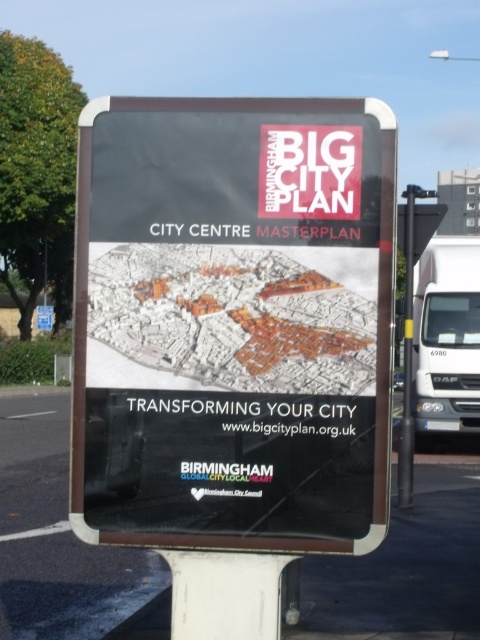
Question: Which object is farther from the camera taking this photo?

Choices:
 (A) matte black sign at center
 (B) blue plastic street sign at upper left
 (C) white plastic pole at right

Answer: (B)

Question: Which object appears farthest from the camera in this image?

Choices:
 (A) white plastic pole at right
 (B) metallic pole at right

Answer: (B)

Question: Is metallic pole at right behind blue plastic street sign at upper left?

Choices:
 (A) yes
 (B) no

Answer: (B)

Question: Can you confirm if matte black sign at center is bigger than white plastic pole at right?

Choices:
 (A) yes
 (B) no

Answer: (B)

Question: Which object is closer to the camera taking this photo?

Choices:
 (A) metallic pole at right
 (B) white plastic pole at right

Answer: (B)

Question: Does white plastic pole at right lie in front of blue plastic street sign at upper left?

Choices:
 (A) no
 (B) yes

Answer: (B)